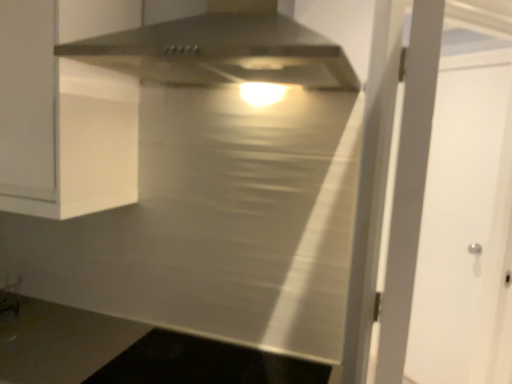
Question: Is black glass cooktop at lower center at the right side of stainless steel range hood at upper center?

Choices:
 (A) no
 (B) yes

Answer: (B)

Question: From the image's perspective, is black glass cooktop at lower center below stainless steel range hood at upper center?

Choices:
 (A) no
 (B) yes

Answer: (B)

Question: Is black glass cooktop at lower center in front of stainless steel range hood at upper center?

Choices:
 (A) no
 (B) yes

Answer: (A)

Question: Is black glass cooktop at lower center wider than stainless steel range hood at upper center?

Choices:
 (A) yes
 (B) no

Answer: (B)

Question: Is black glass cooktop at lower center in contact with stainless steel range hood at upper center?

Choices:
 (A) no
 (B) yes

Answer: (A)

Question: Is black glass cooktop at lower center further to camera compared to stainless steel range hood at upper center?

Choices:
 (A) yes
 (B) no

Answer: (A)

Question: Does white matte door at right appear on the right side of black glass cooktop at lower center?

Choices:
 (A) no
 (B) yes

Answer: (B)

Question: Can you confirm if white matte door at right is wider than black glass cooktop at lower center?

Choices:
 (A) no
 (B) yes

Answer: (A)

Question: Is white matte door at right further to camera compared to black glass cooktop at lower center?

Choices:
 (A) yes
 (B) no

Answer: (A)

Question: From a real-world perspective, does white matte door at right sit lower than black glass cooktop at lower center?

Choices:
 (A) no
 (B) yes

Answer: (A)

Question: Is the surface of white matte door at right in direct contact with black glass cooktop at lower center?

Choices:
 (A) yes
 (B) no

Answer: (B)

Question: Is white matte door at right at the left side of black glass cooktop at lower center?

Choices:
 (A) yes
 (B) no

Answer: (B)

Question: From the image's perspective, is white matte door at right beneath stainless steel range hood at upper center?

Choices:
 (A) no
 (B) yes

Answer: (B)